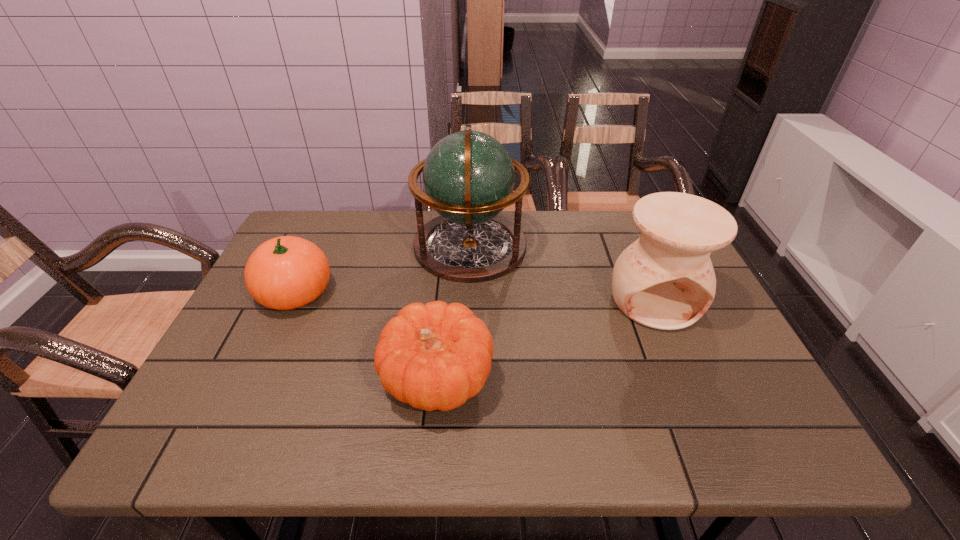
The image size is (960, 540). I want to click on free space located on the left of the nearest object, so click(x=266, y=380).

Identify the location of object that is at the far edge. The width and height of the screenshot is (960, 540). coord(468,177).

Find the location of a particular element. The image size is (960, 540). object that is at the near edge is located at coordinates (435, 356).

Locate an element on the screen. object present at the left edge is located at coordinates coord(287,272).

Locate an element on the screen. object present at the right edge is located at coordinates (665, 280).

Identify the location of vacant region at the far edge of the desktop. The width and height of the screenshot is (960, 540). coord(616,249).

Image resolution: width=960 pixels, height=540 pixels. I want to click on vacant region at the left edge of the desktop, so click(225, 365).

Where is `vacant space at the right edge`? This screenshot has height=540, width=960. vacant space at the right edge is located at coordinates (696, 403).

You are a GUI agent. You are given a task and a screenshot of the screen. Output one action in this format:
    pyautogui.click(x=<x>, y=<y>)
    Task: Click on the free region at the far left corner of the desktop
    
    Given the screenshot: What is the action you would take?
    pyautogui.click(x=336, y=211)

This screenshot has height=540, width=960. Identify the location of vacant region between the rightmost object and the farther pumpkin. (475, 296).